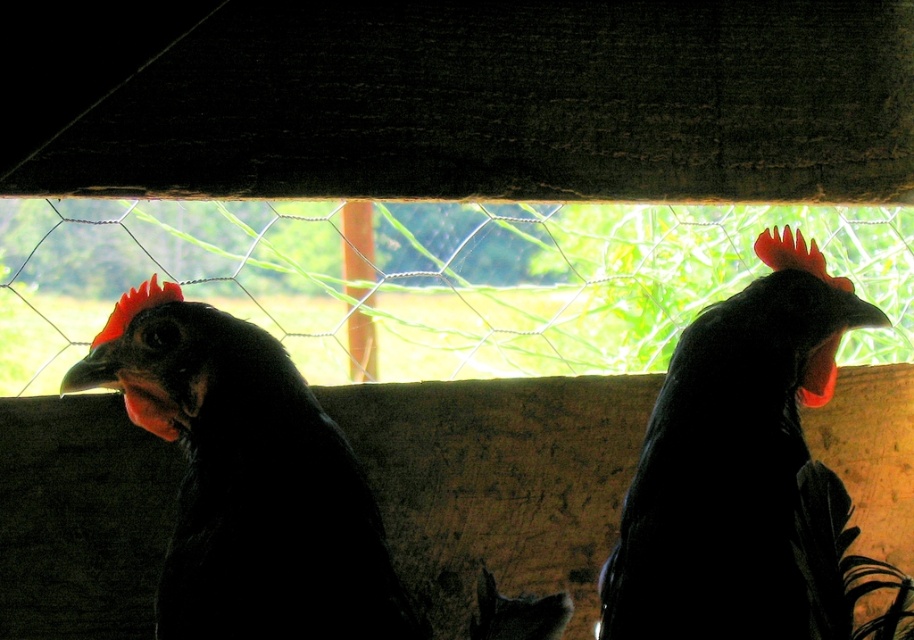
Does matte black chicken at left appear on the right side of black glossy rooster at center?

Incorrect, matte black chicken at left is not on the right side of black glossy rooster at center.

Measure the distance between matte black chicken at left and camera.

The distance of matte black chicken at left from camera is 4.22 feet.

Which is in front, point (254, 348) or point (815, 346)?

Point (254, 348)

Find the location of a particular element. Image resolution: width=914 pixels, height=640 pixels. matte black chicken at left is located at coordinates (247, 481).